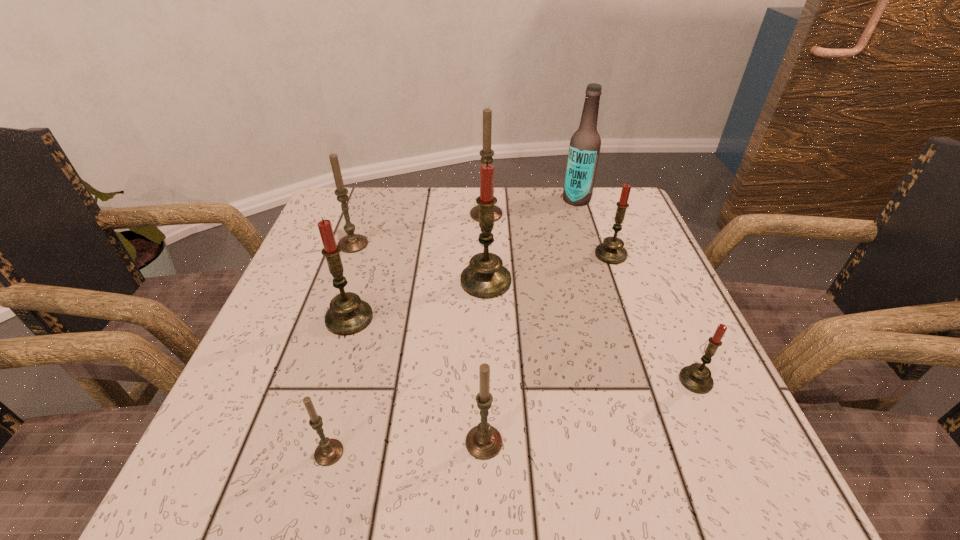
You are a GUI agent. You are given a task and a screenshot of the screen. Output one action in this format:
    pyautogui.click(x=<x>, y=<y>)
    Task: Click on the vacant region located 0.180m on the right of the leftmost red candle
    The width and height of the screenshot is (960, 540).
    Given the screenshot: What is the action you would take?
    pyautogui.click(x=468, y=318)

The image size is (960, 540). I want to click on free space located 0.070m on the front of the third nearest gray candle, so click(x=343, y=274).

The image size is (960, 540). I want to click on vacant space located 0.300m on the front of the second smallest red candle, so click(x=656, y=379).

Where is `free space located on the right of the third biggest gray candle`? free space located on the right of the third biggest gray candle is located at coordinates (632, 442).

Identify the location of vacant position located 0.170m on the back of the rightmost object. The image size is (960, 540). (660, 299).

Where is `vacant space positioned 0.050m on the left of the smallest gray candle`? vacant space positioned 0.050m on the left of the smallest gray candle is located at coordinates (280, 453).

Identify the location of beer bottle at the far edge. This screenshot has height=540, width=960. (585, 143).

Find the location of `beer bottle present at the right edge`. beer bottle present at the right edge is located at coordinates (585, 143).

Identify the location of object situated at the far left corner. This screenshot has width=960, height=540. (352, 243).

Locate an element on the screen. object that is at the near left corner is located at coordinates (329, 451).